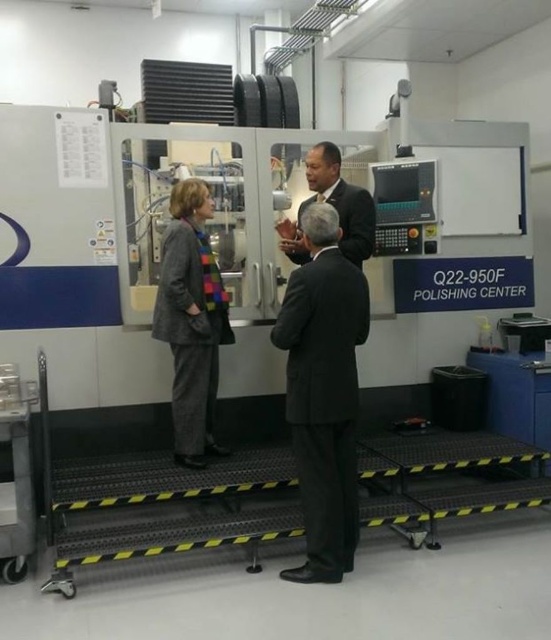
You are an inspector in this industrial setting. You need to check the control panel of the Q22 950F Polishing Center. You see the gray woolen blazer at center and the dark suit at center. Which clothing item is closer to the control panel?

The gray woolen blazer at center is below dark suit at center, so the gray woolen blazer at center is closer to the control panel since it is positioned lower.

You are an assistant at the manufacturing facility. You need to determine which clothing item is narrower between the gray woolen blazer at center and the dark suit at center. Which one is narrower?

The gray woolen blazer at center has a lesser width compared to dark suit at center, so the gray woolen blazer at center is narrower.